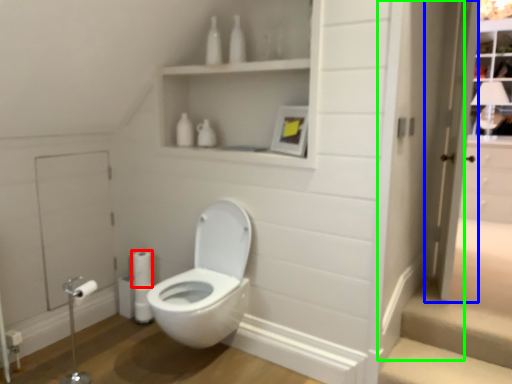
Question: Considering the real-world distances, which object is closest to toilet paper (highlighted by a red box)? screen door (highlighted by a blue box) or door (highlighted by a green box).

Choices:
 (A) screen door
 (B) door

Answer: (B)